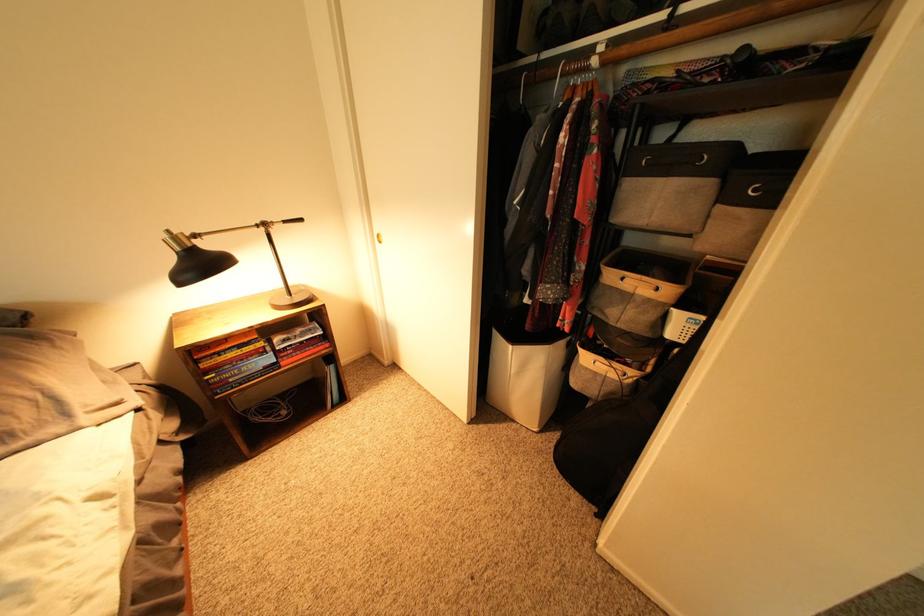
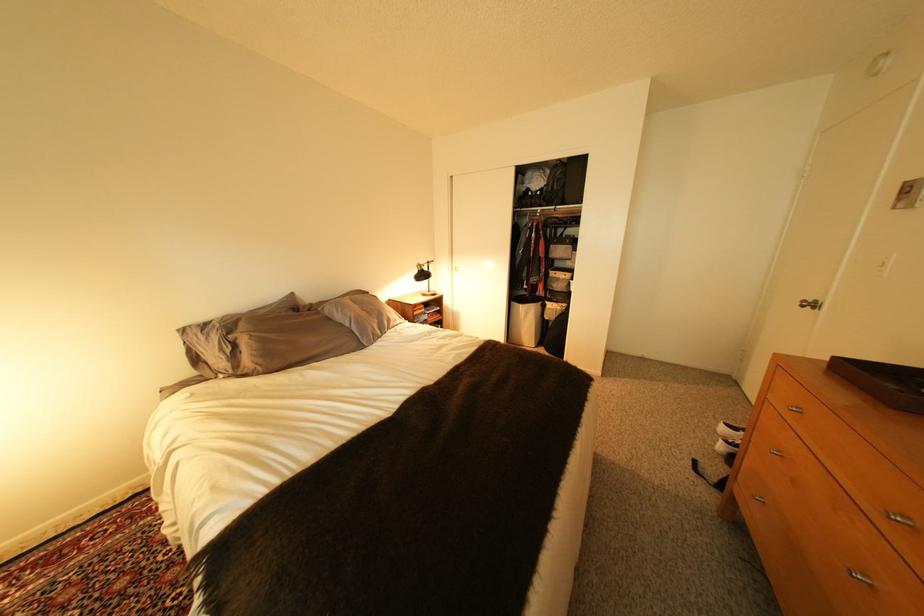
Locate, in the second image, the point that corresponds to pixel 599 370 in the first image.

(563, 310)